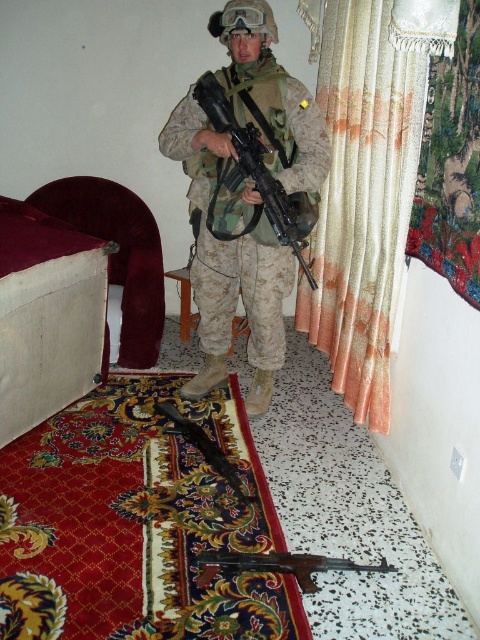
Looking at this image, can you confirm if beige/textured curtain at right is wider than camouflage fabric uniform at center?

No.

Who is higher up, beige/textured curtain at right or camouflage fabric uniform at center?

beige/textured curtain at right is higher up.

Who is more forward, (402, 148) or (263, 323)?

Point (402, 148) is in front.

The image size is (480, 640). In order to click on beige/textured curtain at right in this screenshot , I will do `click(367, 180)`.

Between beige/textured curtain at right and black plastic rifle at center, which one has less height?

With less height is black plastic rifle at center.

Which of these two, beige/textured curtain at right or black plastic rifle at center, stands taller?

beige/textured curtain at right is taller.

Is point (368, 252) positioned after point (368, 570)?

That is True.

You are a GUI agent. You are given a task and a screenshot of the screen. Output one action in this format:
    pyautogui.click(x=<x>, y=<y>)
    Task: Click on the beige/textured curtain at right
    This screenshot has width=480, height=640.
    Given the screenshot: What is the action you would take?
    pyautogui.click(x=367, y=180)

This screenshot has height=640, width=480. I want to click on camouflage fabric uniform at center, so click(228, 250).

The height and width of the screenshot is (640, 480). I want to click on camouflage fabric uniform at center, so click(228, 250).